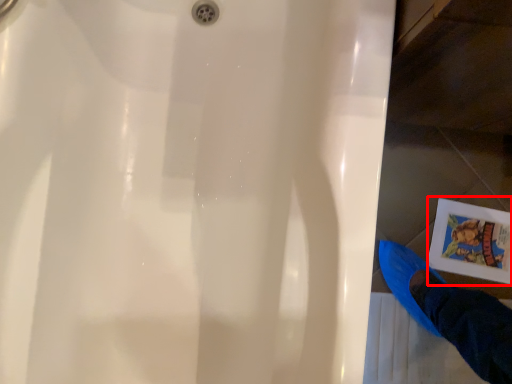
Question: From the image, what is the correct spatial relationship of comic book (annotated by the red box) in relation to person?

Choices:
 (A) right
 (B) left

Answer: (A)